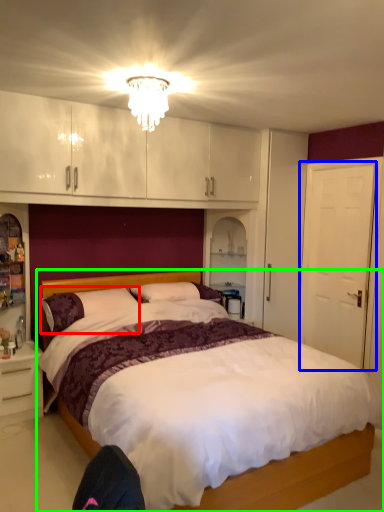
Question: Which object is the farthest from pillow (highlighted by a red box)? Choose among these: door (highlighted by a blue box) or bed (highlighted by a green box).

Choices:
 (A) door
 (B) bed

Answer: (A)